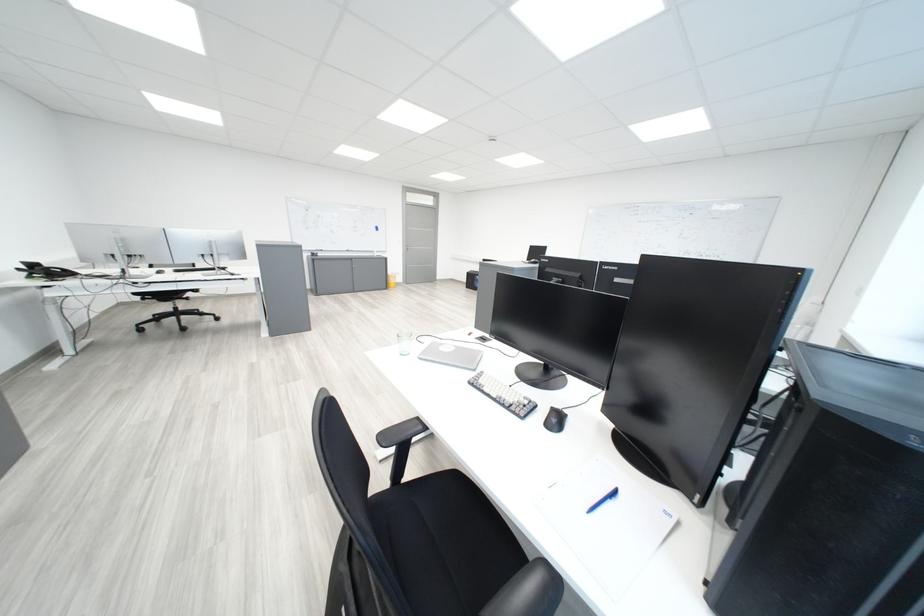
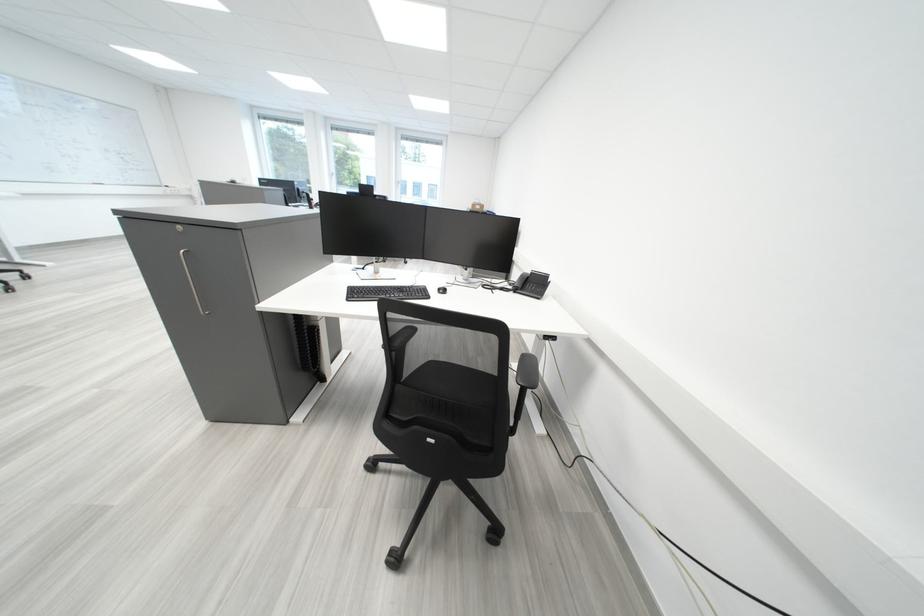
Question: I am providing you with two images of the same scene from different viewpoints. Which of the following objects are not visible in image2?

Choices:
 (A) glass container
 (B) silver cabinet handle
 (C) closed silver laptop
 (D) black telephone handset

Answer: (C)